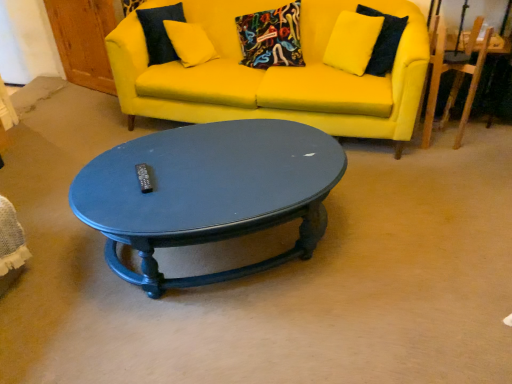
The width and height of the screenshot is (512, 384). In order to click on vacant space to the right of wooden armchair at right in this screenshot , I will do `click(482, 139)`.